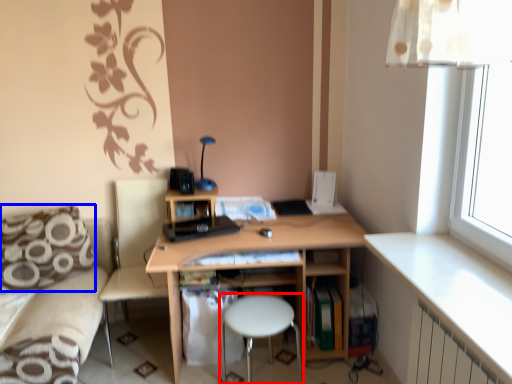
Question: Which of the following is the closest to the observer, bar stool (highlighted by a red box) or pillow (highlighted by a blue box)?

Choices:
 (A) bar stool
 (B) pillow

Answer: (A)